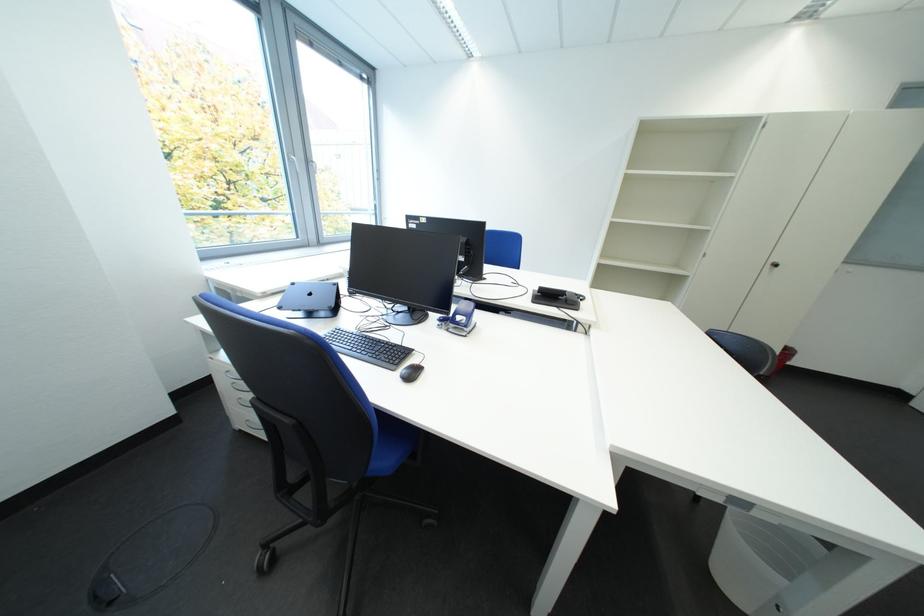
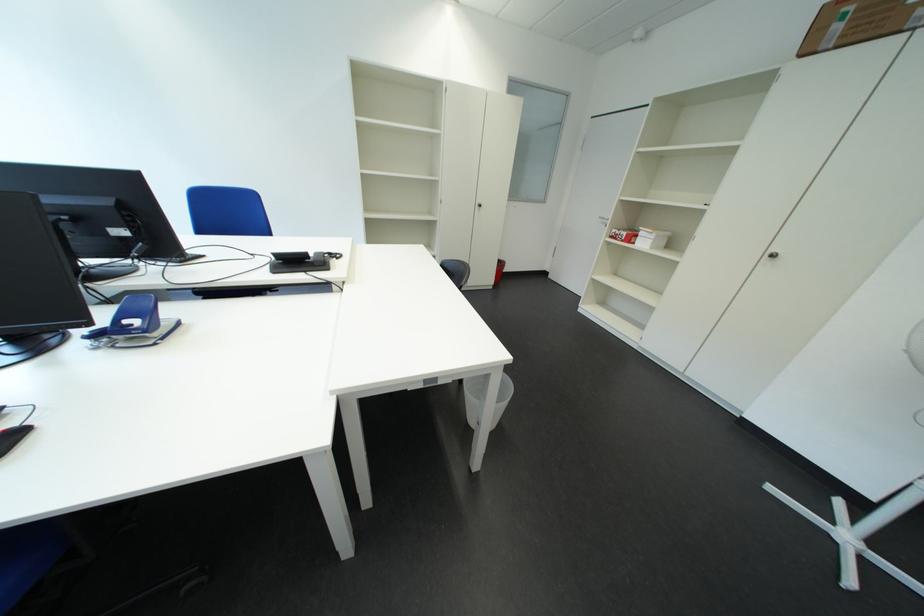
Where in the second image is the point corresponding to (x=426, y=377) from the first image?

(6, 453)